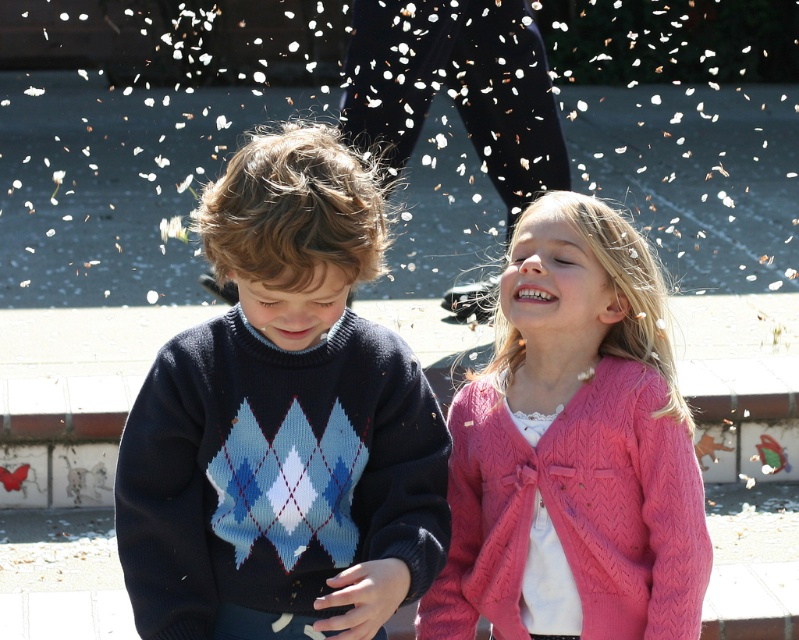
The image size is (799, 640). I want to click on knitted sweater at center, so click(x=283, y=422).

Which is below, knitted sweater at center or pink knitted cardigan at upper right?

pink knitted cardigan at upper right is below.

Does point (223, 362) come in front of point (646, 454)?

Yes, it is in front of point (646, 454).

The image size is (799, 640). Find the location of `knitted sweater at center`. knitted sweater at center is located at coordinates (283, 422).

Between point (623, 131) and point (287, 250), which one is positioned in front?

Point (287, 250) is in front.

The width and height of the screenshot is (799, 640). What are the coordinates of `white paper at center` in the screenshot? It's located at (138, 129).

Is point (241, 58) behind point (539, 413)?

That is True.

Can you confirm if white paper at center is taller than pink knitted cardigan at upper right?

Correct, white paper at center is much taller as pink knitted cardigan at upper right.

The image size is (799, 640). What do you see at coordinates (138, 129) in the screenshot? I see `white paper at center` at bounding box center [138, 129].

This screenshot has height=640, width=799. Identify the location of white paper at center. (138, 129).